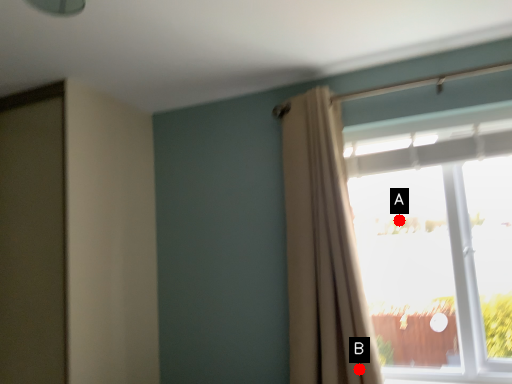
Question: Two points are circled on the image, labeled by A and B beside each circle. Which point appears closest to the camera in this image?

Choices:
 (A) A is closer
 (B) B is closer

Answer: (B)